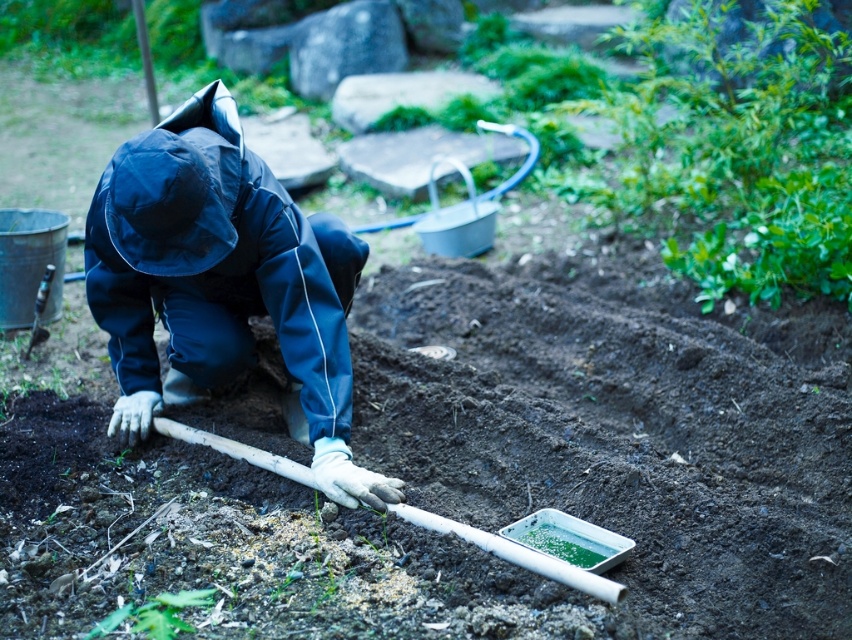
You are a gardener who needs to reach the navy blue waterproof suit at center to adjust it. The dark brown soil at center is blocking your path. Can you move around the soil to access the suit?

The dark brown soil at center is in front of the navy blue waterproof suit at center, so you can move around the soil to access the suit since it is positioned in front of the suit and not directly blocking the sides.

You are helping someone garden and need to place a new plant in the dark brown soil at center. The navy blue waterproof suit at center is in the way. Can you move the plant to the soil without stepping on the suit?

The dark brown soil at center is bigger than the navy blue waterproof suit at center, so you can move the plant to the soil while avoiding stepping on the suit by placing it on the larger area of soil.

You are a gardener who needs to plant a new flower in the dark brown soil at center. The flower requires a hole that is 10 cm deep. Can you determine if the point at coordinates (469, 468) is suitable for planting the flower?

The point at coordinates (469, 468) corresponds to dark brown soil at center, which is suitable for planting the flower as it is the location of the soil where the hole can be dug to the required depth.